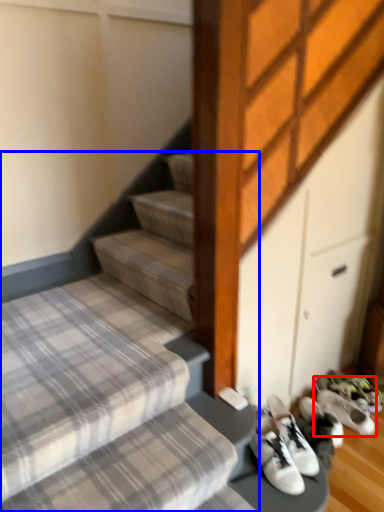
Question: Which object appears farthest to the camera in this image, footwear (highlighted by a red box) or stairs (highlighted by a blue box)?

Choices:
 (A) footwear
 (B) stairs

Answer: (A)